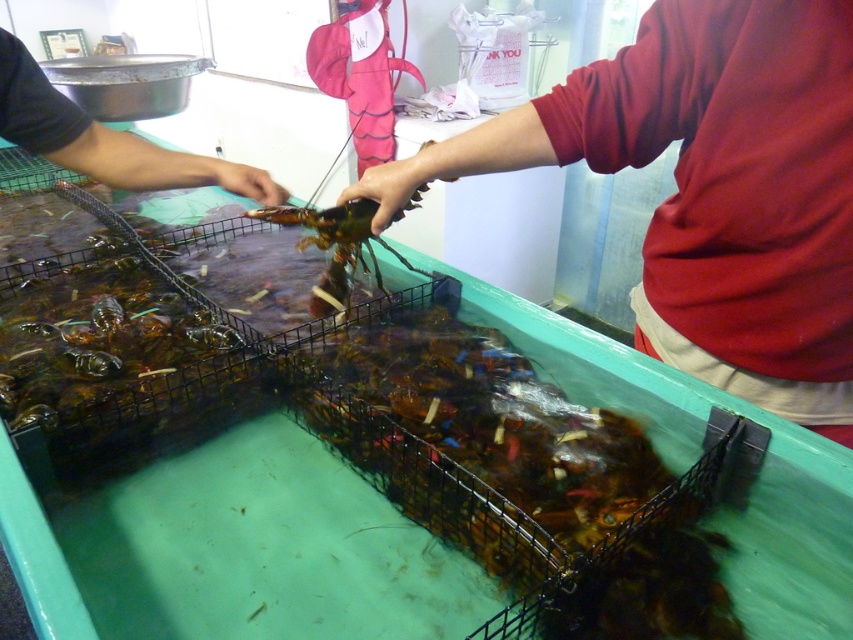
You are a customer observing the lobster tank. You notice the matte red shirt at center and the black matte hand at upper left. Which object is positioned lower in the scene?

The matte red shirt at center is below the black matte hand at upper left, so the matte red shirt at center is positioned lower in the scene.